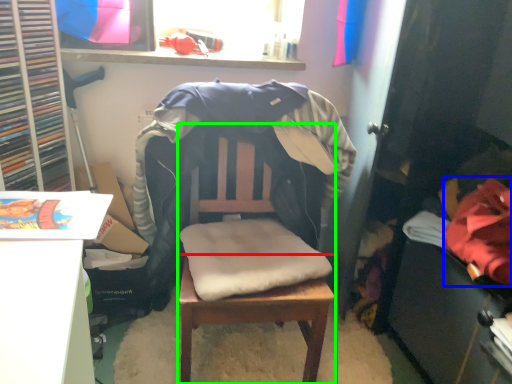
Question: Which object is the farthest from table (highlighted by a red box)? Choose among these: clothing (highlighted by a blue box) or chair (highlighted by a green box).

Choices:
 (A) clothing
 (B) chair

Answer: (A)